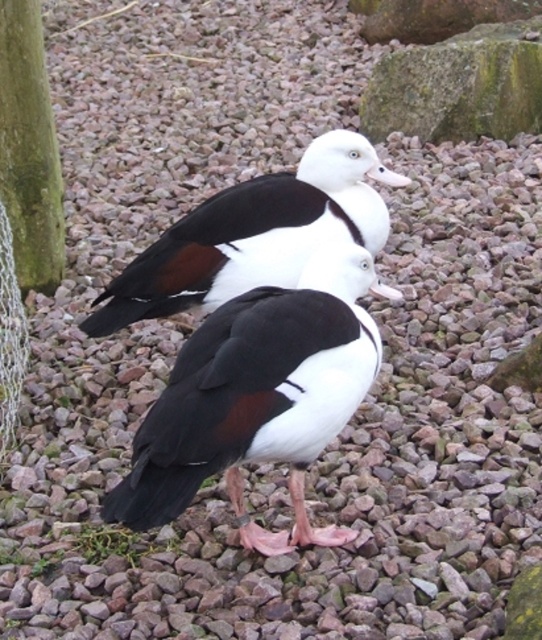
Looking at this image, you are a zookeeper who needs to place a 1.5 meter long feeding tray between the white glossy duck at center and the green mossy tree trunk at left. Will the tray fit without overlapping either object?

The distance between the white glossy duck at center and the green mossy tree trunk at left is 1.31 meters. Since the feeding tray is 1.5 meters long, it will not fit between them without overlapping one or both objects.

You are standing in a serene natural setting with two ducks on a bed of small, reddish brown pebbles. You notice a point marked at coordinates (250, 236). Which duck does this point correspond to?

The point at coordinates (250, 236) corresponds to the white glossy duck at center.